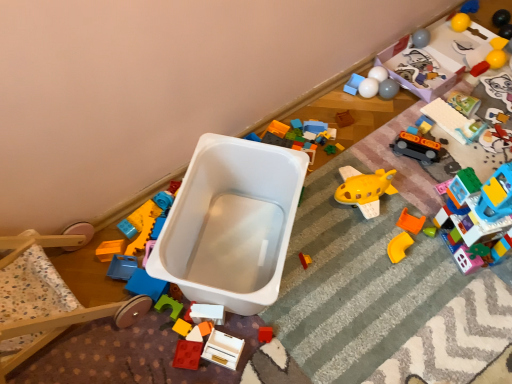
In order to click on vacant space behind orange matte plastic corner piece at lower right, the eighth toy positioned from the left in this screenshot , I will do tap(396, 204).